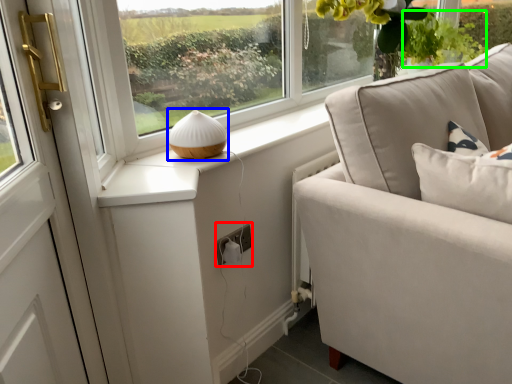
Question: Based on their relative distances, which object is nearer to electric outlet (highlighted by a red box)? Choose from table lamp (highlighted by a blue box) and plant (highlighted by a green box).

Choices:
 (A) table lamp
 (B) plant

Answer: (A)